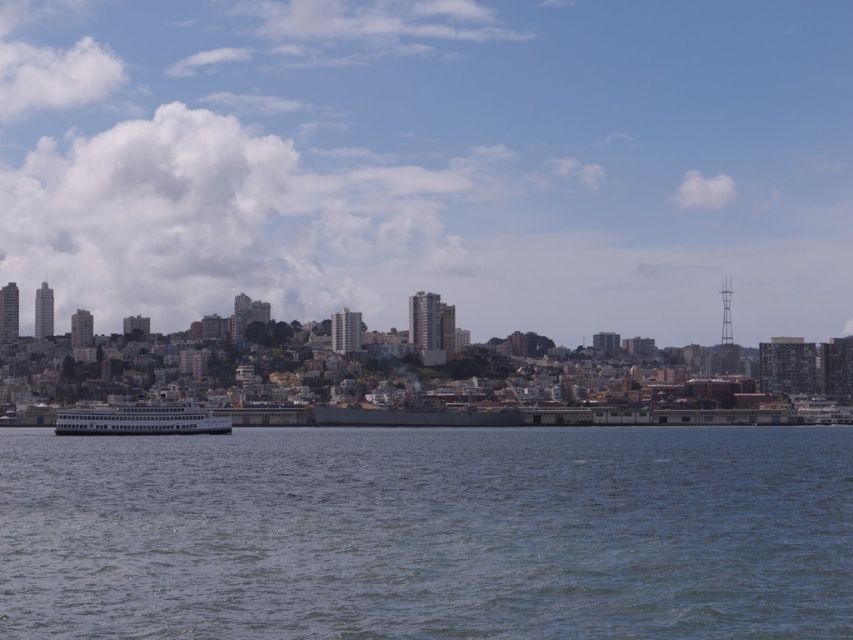
Question: In this image, where is blue water at center located relative to white matte ferry at center?

Choices:
 (A) above
 (B) below

Answer: (B)

Question: Among these objects, which one is farthest from the camera?

Choices:
 (A) blue water at center
 (B) white matte ferry at center

Answer: (B)

Question: Is blue water at center above white matte ferry at center?

Choices:
 (A) yes
 (B) no

Answer: (B)

Question: Which point is closer to the camera?

Choices:
 (A) (120, 420)
 (B) (370, 444)

Answer: (A)

Question: Does blue water at center have a greater width compared to white matte ferry at center?

Choices:
 (A) no
 (B) yes

Answer: (B)